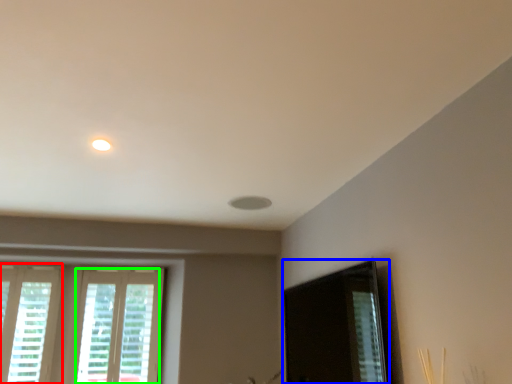
Question: Considering the real-world distances, which object is farthest from window (highlighted by a red box)? screen door (highlighted by a blue box) or window (highlighted by a green box)?

Choices:
 (A) screen door
 (B) window

Answer: (A)